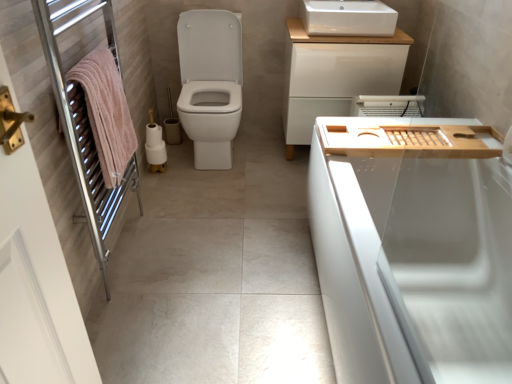
Identify the location of free spot above wooden tray at right (from a real-world perspective). The width and height of the screenshot is (512, 384). (414, 136).